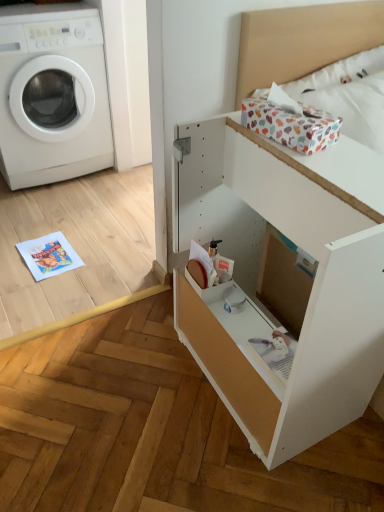
Question: Is white cotton bedding at upper right aimed at white plastic washing machine at left?

Choices:
 (A) yes
 (B) no

Answer: (B)

Question: Does white cotton bedding at upper right have a lesser height compared to white plastic washing machine at left?

Choices:
 (A) no
 (B) yes

Answer: (B)

Question: Is white cotton bedding at upper right at the right side of white plastic washing machine at left?

Choices:
 (A) yes
 (B) no

Answer: (A)

Question: Does white cotton bedding at upper right have a lesser width compared to white plastic washing machine at left?

Choices:
 (A) yes
 (B) no

Answer: (A)

Question: Is white cotton bedding at upper right positioned in front of white plastic washing machine at left?

Choices:
 (A) no
 (B) yes

Answer: (B)

Question: In terms of width, does white cotton bedding at upper right look wider or thinner when compared to white matte file cabinet at center?

Choices:
 (A) wide
 (B) thin

Answer: (B)

Question: From a real-world perspective, relative to white matte file cabinet at center, is white cotton bedding at upper right vertically above or below?

Choices:
 (A) above
 (B) below

Answer: (A)

Question: Is white cotton bedding at upper right inside the boundaries of white matte file cabinet at center, or outside?

Choices:
 (A) outside
 (B) inside

Answer: (A)

Question: From their relative heights in the image, would you say white cotton bedding at upper right is taller or shorter than white matte file cabinet at center?

Choices:
 (A) tall
 (B) short

Answer: (B)

Question: Visually, is white plastic washing machine at left positioned to the left or to the right of white cotton bedding at upper right?

Choices:
 (A) left
 (B) right

Answer: (A)

Question: Is white plastic washing machine at left in front of or behind white cotton bedding at upper right in the image?

Choices:
 (A) behind
 (B) front

Answer: (A)

Question: In terms of height, does white plastic washing machine at left look taller or shorter compared to white cotton bedding at upper right?

Choices:
 (A) tall
 (B) short

Answer: (A)

Question: From a real-world perspective, relative to white cotton bedding at upper right, is white plastic washing machine at left vertically above or below?

Choices:
 (A) above
 (B) below

Answer: (B)

Question: Is white cotton bedding at upper right bigger or smaller than white plastic washing machine at left?

Choices:
 (A) big
 (B) small

Answer: (B)

Question: Is white cotton bedding at upper right wider or thinner than white plastic washing machine at left?

Choices:
 (A) thin
 (B) wide

Answer: (A)